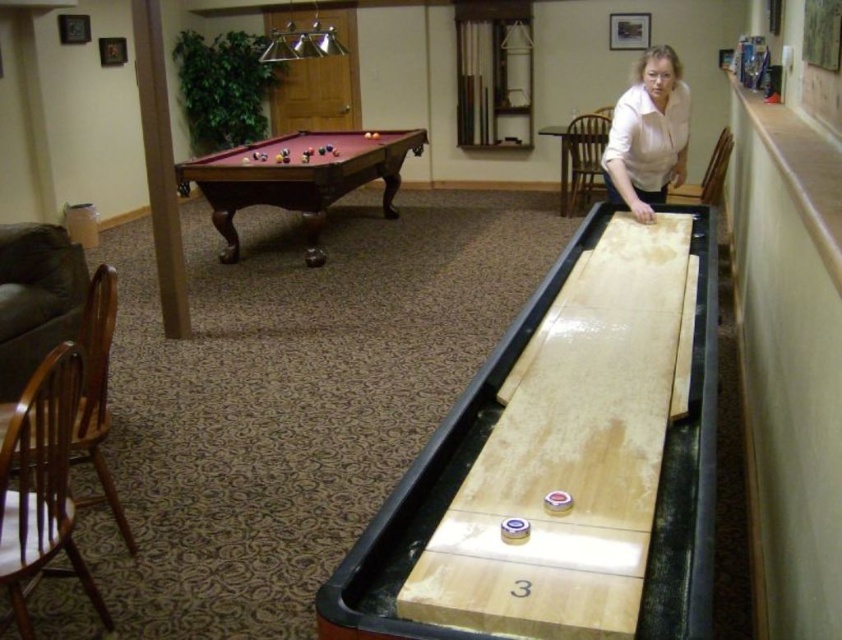
Question: Which of the following is the closest to the observer?

Choices:
 (A) (381, 140)
 (B) (462, 403)

Answer: (B)

Question: Does mahogany wood billiard table at left appear under white smooth shirt at upper right?

Choices:
 (A) no
 (B) yes

Answer: (A)

Question: Is light brown wood billiard table at center above white smooth shirt at upper right?

Choices:
 (A) yes
 (B) no

Answer: (B)

Question: Where is mahogany wood billiard table at left located in relation to white smooth shirt at upper right in the image?

Choices:
 (A) above
 (B) below

Answer: (A)

Question: Which point is closer to the camera?

Choices:
 (A) mahogany wood billiard table at left
 (B) light brown wood billiard table at center

Answer: (B)

Question: Which point appears farthest from the camera in this image?

Choices:
 (A) (312, 157)
 (B) (627, 189)

Answer: (A)